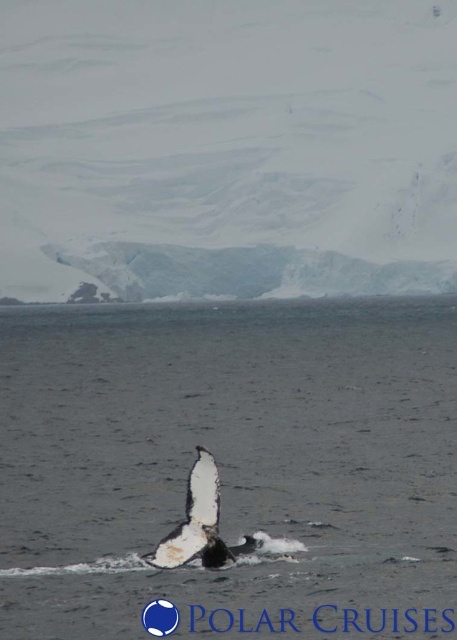
Identify the location of clear water at center. The height and width of the screenshot is (640, 457). pos(226,456).

Is clear water at center behind white matte whale at center?

That is True.

Find the location of a particular element. The width and height of the screenshot is (457, 640). clear water at center is located at coordinates (226, 456).